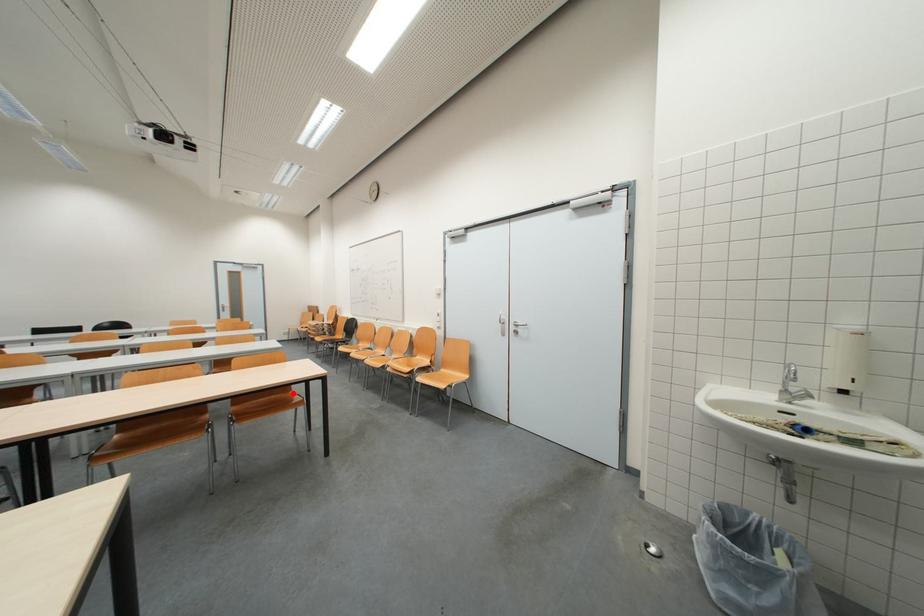
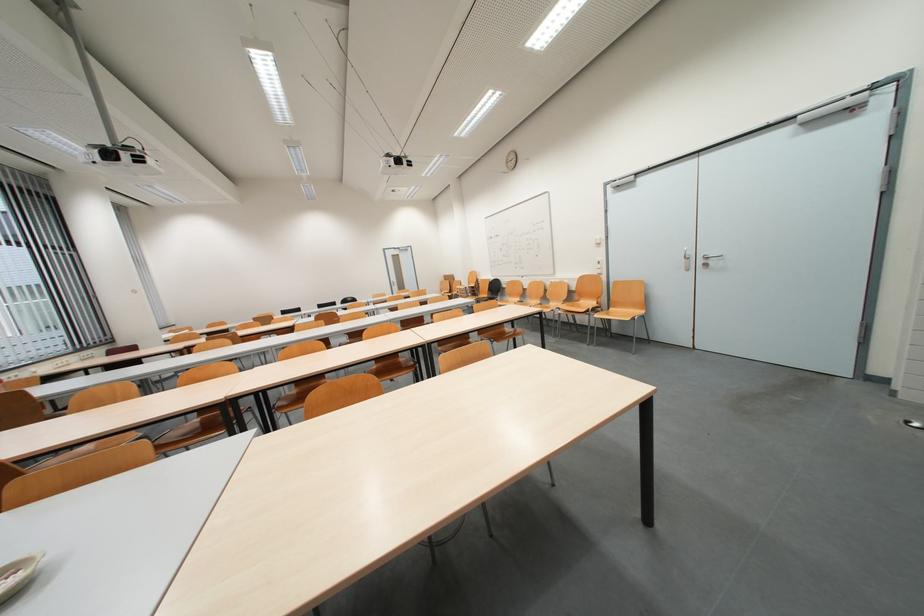
Question: I am providing you with two images of the same scene from different viewpoints. Image1 has a red point marked. In image2, the corresponding 3D location appears at what relative position? Reply with the corresponding letter.

Choices:
 (A) Closer
 (B) Farther

Answer: (A)